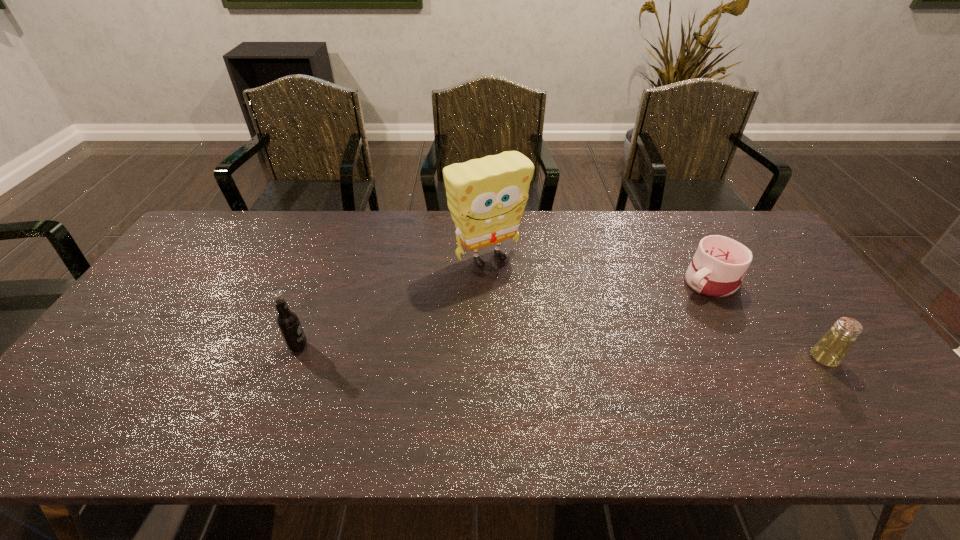
At what (x,y) coordinates should I click in order to perform the action: click on the third shortest object. Please return your answer as a coordinate pair (x, y). Looking at the image, I should click on (288, 322).

The width and height of the screenshot is (960, 540). I want to click on the leftmost object, so click(x=288, y=322).

Locate an element on the screen. saltshaker is located at coordinates (830, 350).

Where is `sponge`? sponge is located at coordinates (486, 197).

Identify the location of the tallest object. (486, 197).

You are a GUI agent. You are given a task and a screenshot of the screen. Output one action in this format:
    pyautogui.click(x=<x>, y=<y>)
    Task: Click on the mug
    Image resolution: width=960 pixels, height=540 pixels.
    Given the screenshot: What is the action you would take?
    pyautogui.click(x=719, y=265)

This screenshot has width=960, height=540. I want to click on vacant space located 0.280m on the label of the third shortest object, so click(417, 347).

Where is `vacant area located 0.080m on the left of the rightmost object`? Image resolution: width=960 pixels, height=540 pixels. vacant area located 0.080m on the left of the rightmost object is located at coordinates (780, 358).

This screenshot has height=540, width=960. In order to click on vacant space situated on the face of the tallest object in this screenshot , I will do `click(544, 322)`.

In order to click on free spot located on the face of the tallest object in this screenshot , I will do `click(580, 364)`.